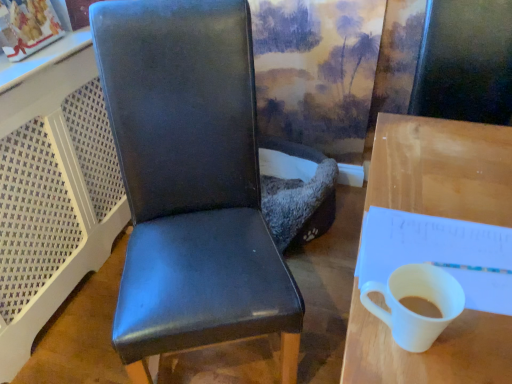
Question: Is white paper notepad at right smaller than white glossy mug at right?

Choices:
 (A) yes
 (B) no

Answer: (B)

Question: Does white paper notepad at right have a larger size compared to white glossy mug at right?

Choices:
 (A) yes
 (B) no

Answer: (A)

Question: Would you say white paper notepad at right contains white glossy mug at right?

Choices:
 (A) yes
 (B) no

Answer: (B)

Question: Is white paper notepad at right far away from white glossy mug at right?

Choices:
 (A) no
 (B) yes

Answer: (A)

Question: Can you confirm if white paper notepad at right is positioned to the left of white glossy mug at right?

Choices:
 (A) yes
 (B) no

Answer: (B)

Question: Is white paper notepad at right aimed at white glossy mug at right?

Choices:
 (A) yes
 (B) no

Answer: (B)

Question: Is white paper notepad at right smaller than wooden desk at right?

Choices:
 (A) no
 (B) yes

Answer: (B)

Question: Can you confirm if white paper notepad at right is wider than wooden desk at right?

Choices:
 (A) yes
 (B) no

Answer: (B)

Question: From a real-world perspective, does white paper notepad at right stand above wooden desk at right?

Choices:
 (A) no
 (B) yes

Answer: (B)

Question: From the image's perspective, is white paper notepad at right under wooden desk at right?

Choices:
 (A) no
 (B) yes

Answer: (A)

Question: Is white paper notepad at right far from wooden desk at right?

Choices:
 (A) yes
 (B) no

Answer: (B)

Question: From the image's perspective, is white paper notepad at right on wooden desk at right?

Choices:
 (A) no
 (B) yes

Answer: (B)

Question: Is matte black chair at center not near white paper notepad at right?

Choices:
 (A) no
 (B) yes

Answer: (A)